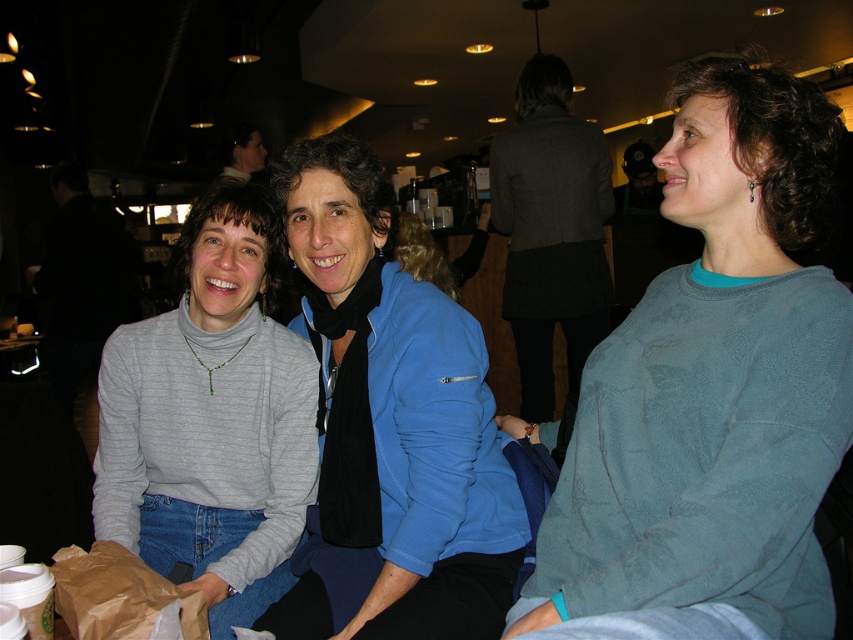
Who is positioned more to the right, blue fleece jacket at center or brown paper bag at lower left?

blue fleece jacket at center

Which is below, blue fleece jacket at center or brown paper bag at lower left?

brown paper bag at lower left

Between point (329, 205) and point (169, 605), which one is positioned behind?

The point (329, 205) is more distant.

I want to click on blue fleece jacket at center, so click(x=393, y=419).

Which is in front, point (619, 336) or point (338, 388)?

Point (619, 336) is in front.

Who is positioned more to the right, teal sweater at center or blue fleece jacket at center?

teal sweater at center

Does point (757, 380) come closer to viewer compared to point (498, 564)?

Yes, point (757, 380) is in front of point (498, 564).

Where is `teal sweater at center`? teal sweater at center is located at coordinates (714, 385).

Between teal sweater at center and brown paper bag at lower left, which one is positioned lower?

Positioned lower is brown paper bag at lower left.

Who is more distant from viewer, [804,358] or [113,604]?

Point [113,604]

In order to click on teal sweater at center in this screenshot , I will do `click(714, 385)`.